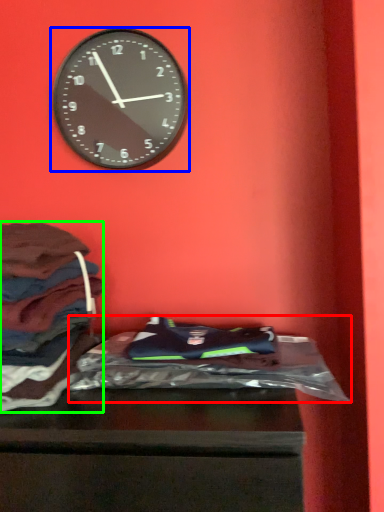
Question: Based on their relative distances, which object is farther from material (highlighted by a red box)? Choose from wall clock (highlighted by a blue box) and clothing (highlighted by a green box).

Choices:
 (A) wall clock
 (B) clothing

Answer: (A)